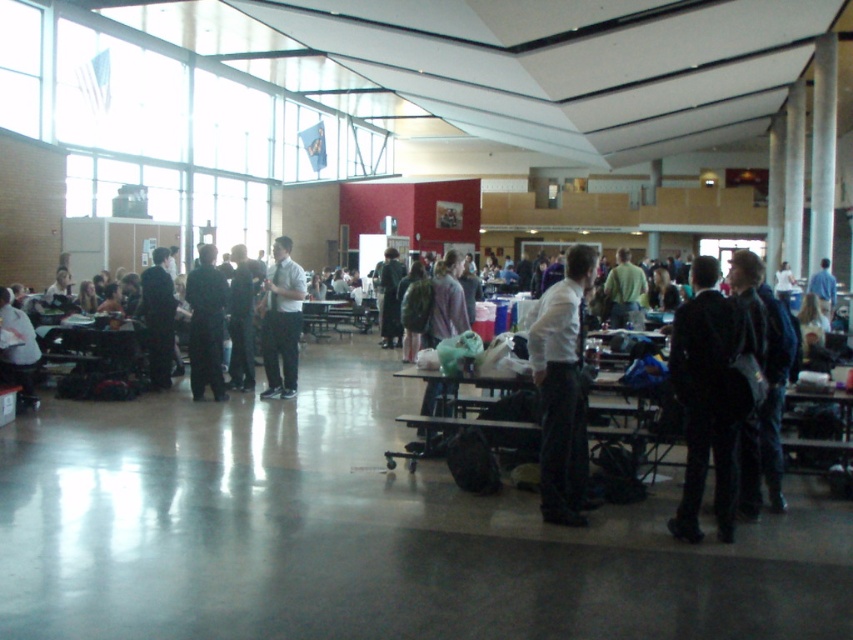
Is dark suit at left to the right of blue shirt at center from the viewer's perspective?

No, dark suit at left is not to the right of blue shirt at center.

Does dark suit at left have a greater height compared to blue shirt at center?

Yes, dark suit at left is taller than blue shirt at center.

Is point (148, 332) positioned after point (825, 282)?

No, it is not.

Locate an element on the screen. dark suit at left is located at coordinates (158, 317).

Which is behind, point (569, 292) or point (10, 333)?

Point (10, 333)

Between white shirt at center and matte black backpack at left, which one appears on the right side from the viewer's perspective?

From the viewer's perspective, white shirt at center appears more on the right side.

The image size is (853, 640). Describe the element at coordinates (561, 390) in the screenshot. I see `white shirt at center` at that location.

Locate an element on the screen. The height and width of the screenshot is (640, 853). white shirt at center is located at coordinates (561, 390).

Does point (701, 410) come farther from viewer compared to point (283, 384)?

No, it is in front of (283, 384).

Who is more distant from viewer, (x=694, y=426) or (x=276, y=300)?

The point (x=276, y=300) is behind.

The width and height of the screenshot is (853, 640). Find the location of `black suit at right`. black suit at right is located at coordinates (706, 397).